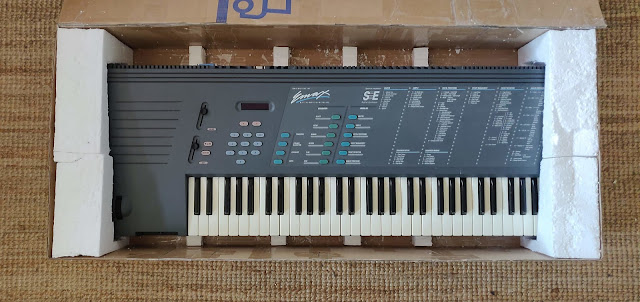
Where is `rug`? This screenshot has height=302, width=640. rug is located at coordinates tap(617, 205).